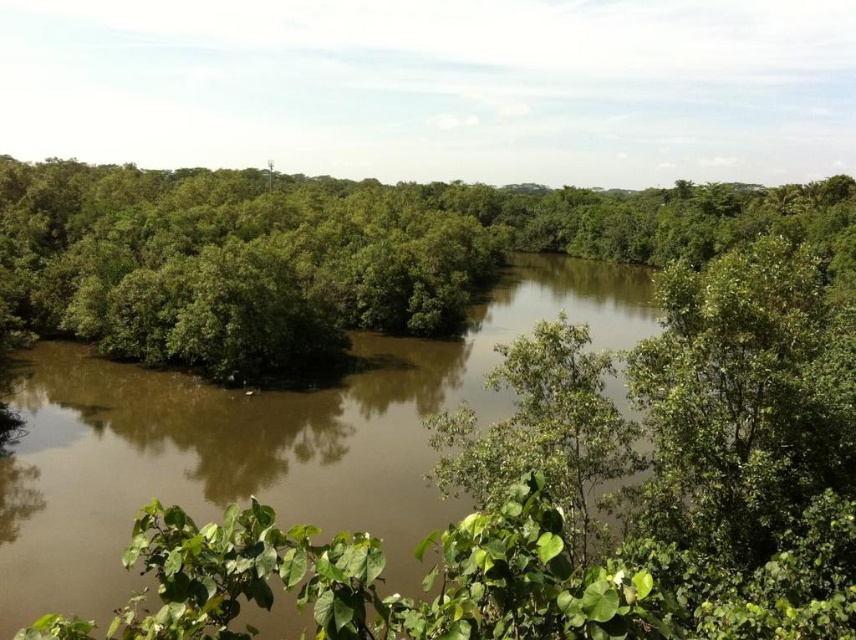
Question: Does green leafy trees at center come behind brown muddy water at center?

Choices:
 (A) yes
 (B) no

Answer: (A)

Question: Does green leafy trees at center have a smaller size compared to brown muddy water at center?

Choices:
 (A) no
 (B) yes

Answer: (A)

Question: Which point is farther to the camera?

Choices:
 (A) (108, 221)
 (B) (482, 356)

Answer: (A)

Question: Is green leafy trees at center thinner than brown muddy water at center?

Choices:
 (A) yes
 (B) no

Answer: (B)